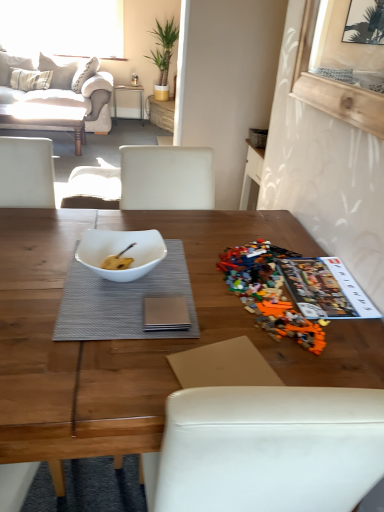
The image size is (384, 512). I want to click on white paper magazine at right, so click(x=325, y=289).

Identify the location of plaid fabric pillow at upper left, which ranks as the second pillow in right-to-left order. (12, 66).

At what (x,y) coordinates should I click in order to perform the action: click on multicolored plastic lego set at right. Please return your answer as a coordinate pair (x, y). The image size is (384, 512). Looking at the image, I should click on (269, 293).

Describe the element at coordinates (59, 70) in the screenshot. Image resolution: width=384 pixels, height=512 pixels. I see `beige fabric pillow at upper left, which ranks as the 1th pillow in right-to-left order` at that location.

What is the approximate width of beige fabric pillow at upper left, acting as the 2th pillow starting from the left?

beige fabric pillow at upper left, acting as the 2th pillow starting from the left, is 13.48 inches wide.

What do you see at coordinates (137, 340) in the screenshot?
I see `wooden table at center, acting as the first coffee table starting from the right` at bounding box center [137, 340].

Locate an element on the screen. The height and width of the screenshot is (512, 384). transparent glass window at upper center is located at coordinates pyautogui.click(x=63, y=26).

From the image's perspective, is gray textured placemat at center under transparent glass window at upper center?

Correct, gray textured placemat at center appears lower than transparent glass window at upper center in the image.

How distant is gray textured placemat at center from transparent glass window at upper center?

A distance of 6.04 meters exists between gray textured placemat at center and transparent glass window at upper center.

Does gray textured placemat at center have a lesser width compared to transparent glass window at upper center?

In fact, gray textured placemat at center might be wider than transparent glass window at upper center.

Find the location of a particular element. Image resolution: width=384 pixels, height=512 pixels. window located above the gray textured placemat at center (from a real-world perspective) is located at coordinates (63, 26).

Is multicolored plastic lego set at right at the right side of white paper magazine at right?

No, multicolored plastic lego set at right is not to the right of white paper magazine at right.

Looking at their sizes, would you say multicolored plastic lego set at right is wider or thinner than white paper magazine at right?

Clearly, multicolored plastic lego set at right has more width compared to white paper magazine at right.

From a real-world perspective, between multicolored plastic lego set at right and white paper magazine at right, who is vertically higher?

white paper magazine at right is physically above.

From the image's perspective, is multicolored plastic lego set at right on white paper magazine at right?

Yes.

What's the angular difference between metallic silver table at center and multicolored plastic lego set at right's facing directions?

The angle between the facing direction of metallic silver table at center and the facing direction of multicolored plastic lego set at right is 90.8 degrees.

Considering the positions of points (118, 84) and (282, 306), is point (118, 84) farther from camera compared to point (282, 306)?

Yes, it is.

From a real-world perspective, between metallic silver table at center and multicolored plastic lego set at right, who is vertically lower?

metallic silver table at center is physically lower.

Considering their positions, is metallic silver table at center located in front of or behind multicolored plastic lego set at right?

metallic silver table at center is behind multicolored plastic lego set at right.

Does point (308, 266) appear closer or farther from the camera than point (141, 99)?

Clearly, point (308, 266) is closer to the camera than point (141, 99).

Which object is further away from the camera taking this photo, white paper magazine at right or metallic silver table at center?

metallic silver table at center is more distant.

Is white paper magazine at right facing away from metallic silver table at center?

No, white paper magazine at right is not facing away from metallic silver table at center.

Is white paper magazine at right wider than metallic silver table at center?

Incorrect, the width of white paper magazine at right does not surpass that of metallic silver table at center.

Starting from the gray textured placemat at center, which pillow is the 2nd one to the left? Please provide its 2D coordinates.

[(12, 66)]

Are gray textured placemat at center and plaid fabric pillow at upper left, the 1th pillow viewed from the left, beside each other?

gray textured placemat at center and plaid fabric pillow at upper left, the 1th pillow viewed from the left, are clearly separated.

From the image's perspective, between gray textured placemat at center and plaid fabric pillow at upper left, the 1th pillow viewed from the left, which one is located above?

plaid fabric pillow at upper left, the 1th pillow viewed from the left, from the image's perspective.

Does gray textured placemat at center have a smaller size compared to plaid fabric pillow at upper left, the 1th pillow viewed from the left?

Yes.

Where is `coffee table that is on the right side of metallic silver table at center`? The width and height of the screenshot is (384, 512). coffee table that is on the right side of metallic silver table at center is located at coordinates (137, 340).

Looking at this image, from the image's perspective, does wooden table at center, the second coffee table positioned from the left, appear lower than metallic silver table at center?

Yes, from the image's perspective, wooden table at center, the second coffee table positioned from the left, is beneath metallic silver table at center.

Which of these two, wooden table at center, the first coffee table in the front-to-back sequence, or metallic silver table at center, stands shorter?

metallic silver table at center is shorter.

Which object is closer to the camera taking this photo, wooden table at center, the first coffee table in the front-to-back sequence, or metallic silver table at center?

wooden table at center, the first coffee table in the front-to-back sequence, is in front.

From the image's perspective, is beige fabric couch at upper left under gray textured placemat at center?

No.

Is beige fabric couch at upper left directly adjacent to gray textured placemat at center?

No, beige fabric couch at upper left is not with gray textured placemat at center.

Considering the relative sizes of beige fabric couch at upper left and gray textured placemat at center in the image provided, is beige fabric couch at upper left thinner than gray textured placemat at center?

In fact, beige fabric couch at upper left might be wider than gray textured placemat at center.

What's the angular difference between beige fabric couch at upper left and gray textured placemat at center's facing directions?

The angle between the facing direction of beige fabric couch at upper left and the facing direction of gray textured placemat at center is 89.4 degrees.

What are the coordinates of `window on the left of gray textured placemat at center` in the screenshot? It's located at (63, 26).

I want to click on magazine located below the multicolored plastic lego set at right (from the image's perspective), so click(x=325, y=289).

Based on their spatial positions, is plaid fabric pillow at upper left, which ranks as the second pillow in right-to-left order, or beige fabric pillow at upper left, acting as the 2th pillow starting from the left, closer to white paper magazine at right?

The object closer to white paper magazine at right is beige fabric pillow at upper left, acting as the 2th pillow starting from the left.

When comparing their distances from multicolored plastic lego set at right, does beige fabric couch at upper left or green leafy plant in gold pot at upper center seem closer?

beige fabric couch at upper left is positioned closer to the anchor multicolored plastic lego set at right.

Considering their positions, is gray textured placemat at center positioned further to green leafy plant in gold pot at upper center than plaid fabric pillow at upper left, which ranks as the second pillow in right-to-left order?

Among the two, gray textured placemat at center is located further to green leafy plant in gold pot at upper center.

Looking at the image, which one is located further to plaid fabric pillow at upper left, which ranks as the second pillow in right-to-left order, transparent glass window at upper center or white paper magazine at right?

white paper magazine at right is positioned further to the anchor plaid fabric pillow at upper left, which ranks as the second pillow in right-to-left order.

From the image, which object appears to be nearer to plaid fabric pillow at upper left, which ranks as the second pillow in right-to-left order, metallic silver table at center or beige fabric pillow at upper left, which ranks as the 1th pillow in right-to-left order?

beige fabric pillow at upper left, which ranks as the 1th pillow in right-to-left order, lies closer to plaid fabric pillow at upper left, which ranks as the second pillow in right-to-left order, than the other object.

Which object lies further to the anchor point matte white coffee table at upper left, which is the first coffee table in back-to-front order, beige fabric couch at upper left or white paper magazine at right?

Among the two, white paper magazine at right is located further to matte white coffee table at upper left, which is the first coffee table in back-to-front order.

Looking at this image, which object lies further to the anchor point beige fabric couch at upper left, gray textured placemat at center or multicolored plastic lego set at right?

multicolored plastic lego set at right is positioned further to the anchor beige fabric couch at upper left.

From the image, which object appears to be farther from metallic silver table at center, gray textured placemat at center or white paper magazine at right?

Based on the image, white paper magazine at right appears to be further to metallic silver table at center.

Where is `window between white paper magazine at right and metallic silver table at center from front to back`? The image size is (384, 512). window between white paper magazine at right and metallic silver table at center from front to back is located at coordinates (63, 26).

This screenshot has width=384, height=512. I want to click on coffee table between multicolored plastic lego set at right and beige fabric pillow at upper left, which ranks as the 1th pillow in right-to-left order, along the z-axis, so click(x=45, y=119).

Locate an element on the screen. studio couch between white paper magazine at right and metallic silver table at center from front to back is located at coordinates (60, 87).

I want to click on pillow located between beige fabric couch at upper left and beige fabric pillow at upper left, which ranks as the 1th pillow in right-to-left order, in the depth direction, so click(x=12, y=66).